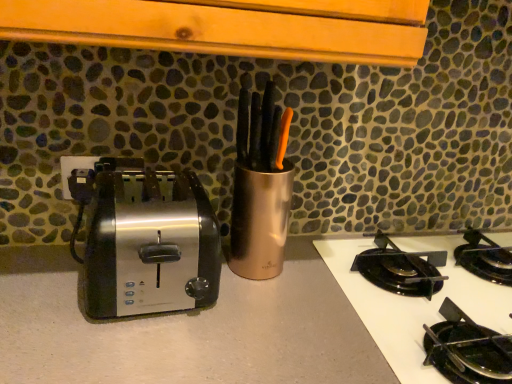
In order to click on vacant area that lies between black glass cooktop at lower right and satin metallic toaster at left in this screenshot , I will do click(256, 326).